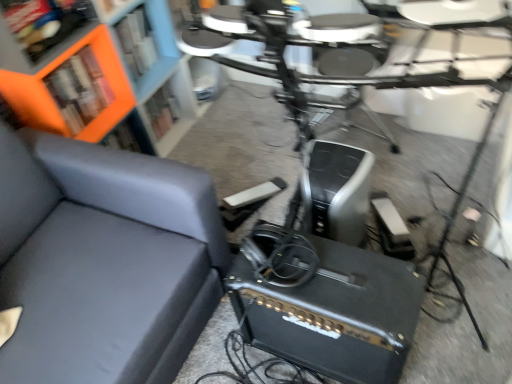
Question: Is orange matte bookcase at upper left in front of or behind matte gray couch at left in the image?

Choices:
 (A) front
 (B) behind

Answer: (B)

Question: Choose the correct answer: Is orange matte bookcase at upper left inside matte gray couch at left or outside it?

Choices:
 (A) inside
 (B) outside

Answer: (B)

Question: Which object is the closest to the black matte speaker at lower center?

Choices:
 (A) orange matte bookshelf at upper left
 (B) matte gray couch at left
 (C) orange matte bookcase at upper left

Answer: (B)

Question: Considering the real-world distances, which object is farthest from the matte gray couch at left?

Choices:
 (A) orange matte bookshelf at upper left
 (B) orange matte bookcase at upper left
 (C) black matte speaker at lower center

Answer: (A)